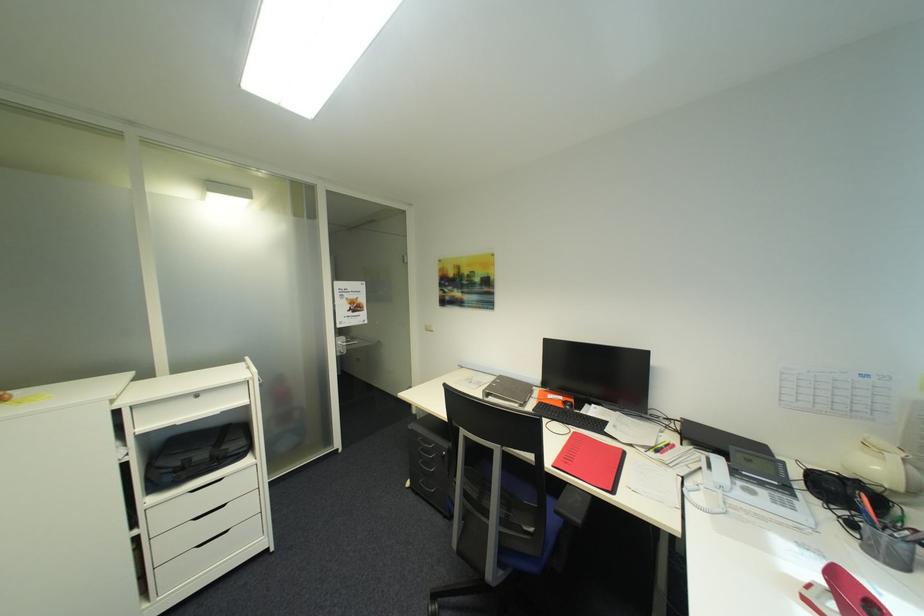
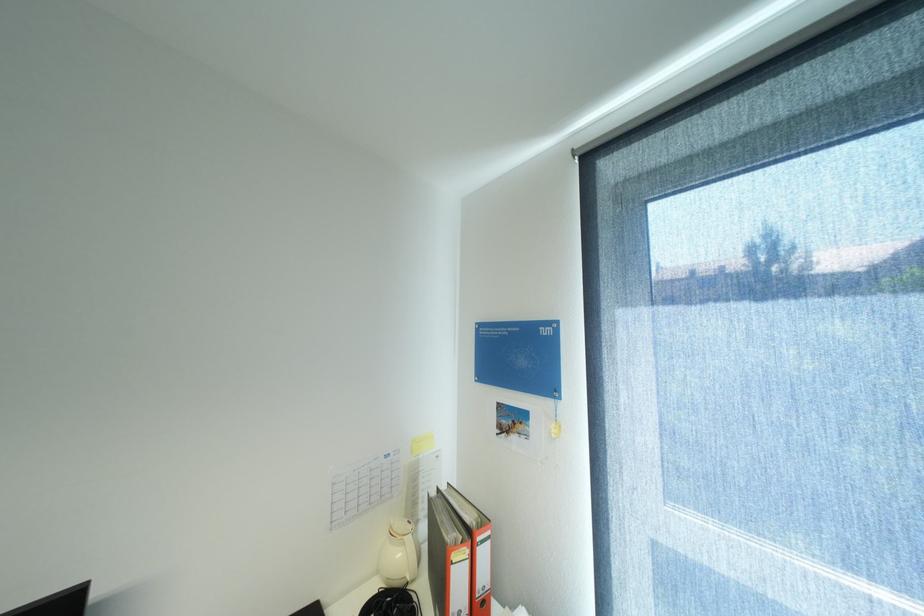
Question: The camera is either moving clockwise (left) or counter-clockwise (right) around the object. The first image is from the beginning of the video and the second image is from the end. Is the camera moving left or right when shooting the video?

Choices:
 (A) Left
 (B) Right

Answer: (A)